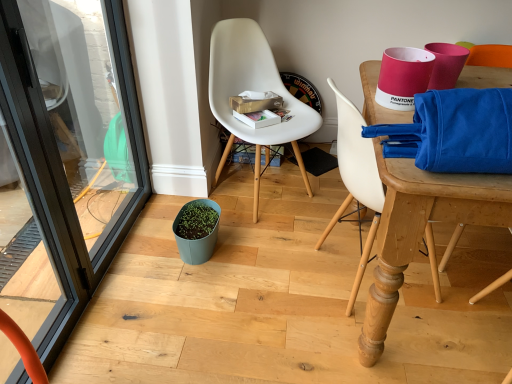
Question: Is black glass screen door at left to the left or to the right of white plastic chair at center, which is the second chair from right to left, in the image?

Choices:
 (A) right
 (B) left

Answer: (B)

Question: Is black glass screen door at left in front of or behind white plastic chair at center, which is the second chair from right to left, in the image?

Choices:
 (A) front
 (B) behind

Answer: (A)

Question: Estimate the real-world distances between objects in this image. Which object is closer to the white plastic chair at center, placed as the 1th chair when sorted from left to right?

Choices:
 (A) white plastic chair at upper right, marked as the 1th chair in a right-to-left arrangement
 (B) teal matte flowerpot at center
 (C) black glass screen door at left

Answer: (B)

Question: Which of these objects is positioned closest to the teal matte flowerpot at center?

Choices:
 (A) white plastic chair at upper right, marked as the 1th chair in a right-to-left arrangement
 (B) white plastic chair at center, which is the second chair from right to left
 (C) black glass screen door at left

Answer: (B)